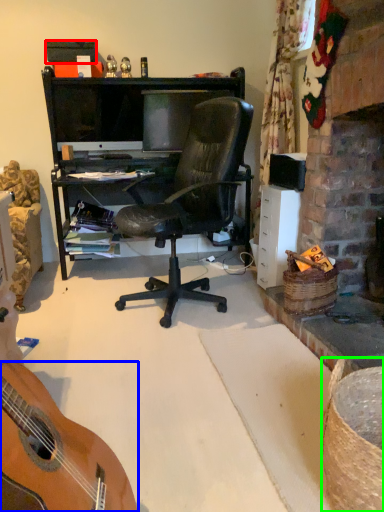
Question: Considering the real-world distances, which object is closest to box (highlighted by a red box)? guitar (highlighted by a blue box) or picnic basket (highlighted by a green box).

Choices:
 (A) guitar
 (B) picnic basket

Answer: (A)